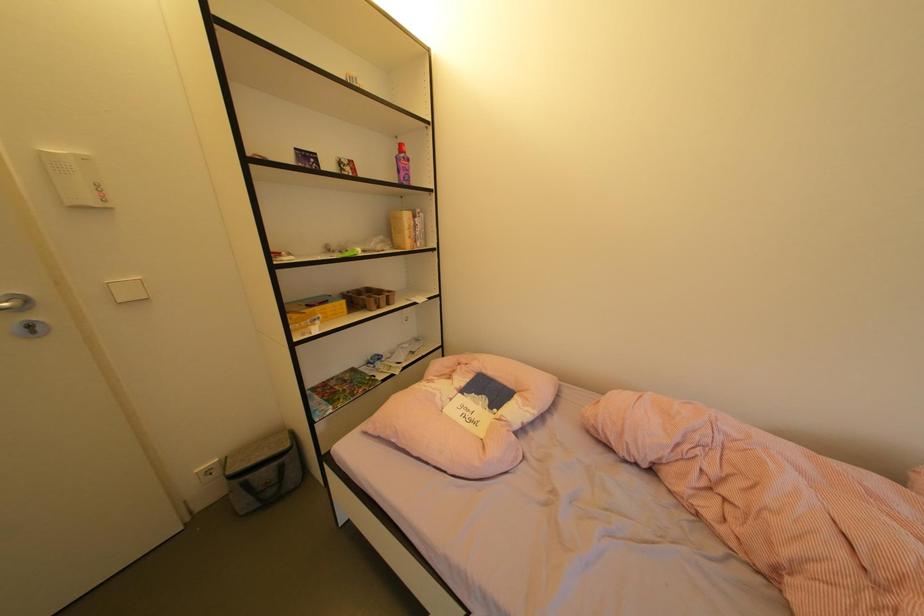
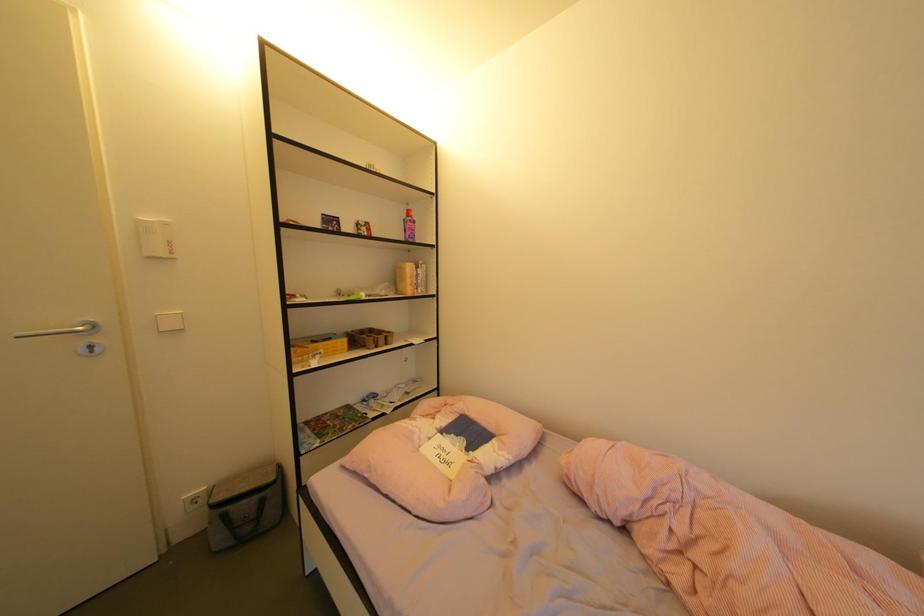
Question: How did the camera likely rotate?

Choices:
 (A) Left
 (B) Right
 (C) Up
 (D) Down

Answer: (C)